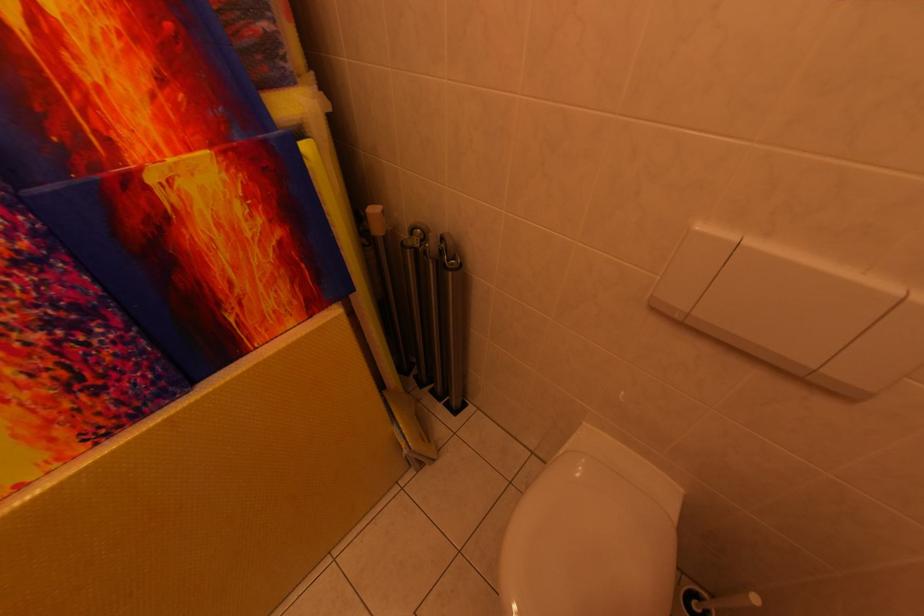
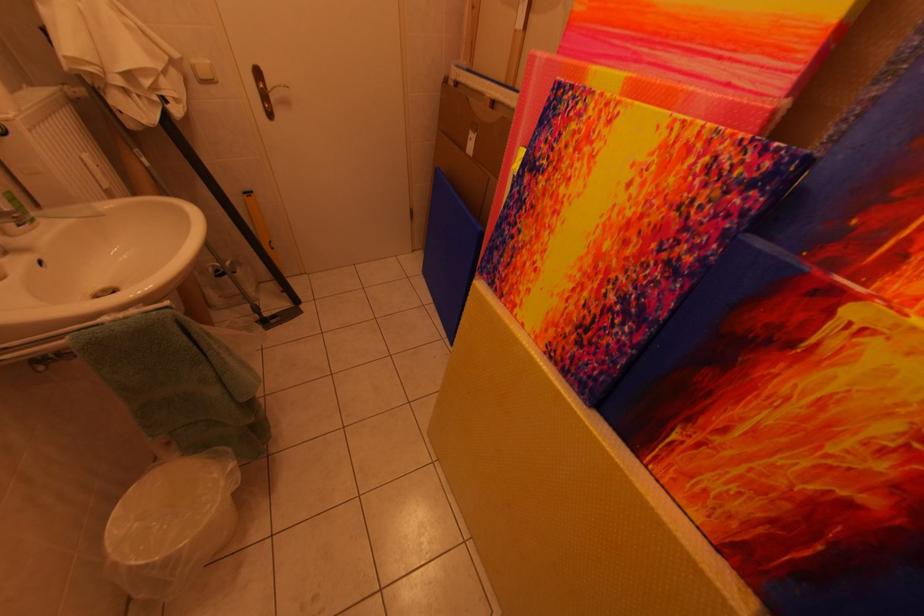
In the second image, find the point that corresponds to (x=161, y=183) in the first image.

(861, 317)